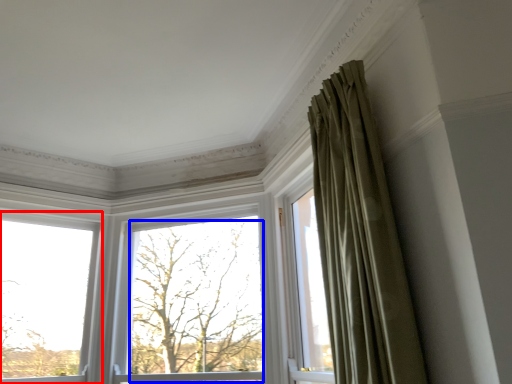
Question: Which object appears farthest to the camera in this image, window (highlighted by a red box) or tree (highlighted by a blue box)?

Choices:
 (A) window
 (B) tree

Answer: (B)